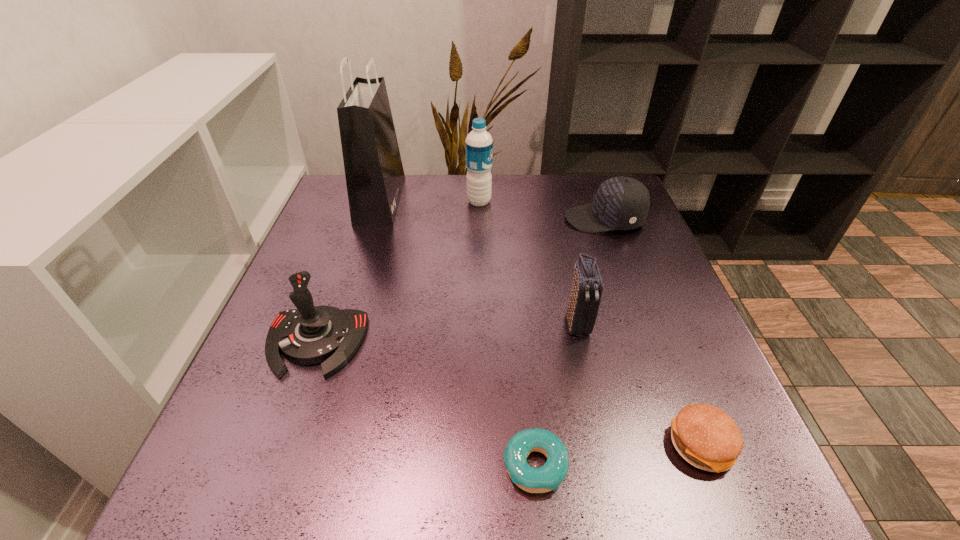
Where is `baseball cap at the far edge`? baseball cap at the far edge is located at coordinates (621, 203).

Find the location of a particular element. hamburger that is positioned at the near edge is located at coordinates (705, 436).

Where is `doughnut located in the near edge section of the desktop`? This screenshot has width=960, height=540. doughnut located in the near edge section of the desktop is located at coordinates (548, 477).

The height and width of the screenshot is (540, 960). I want to click on shopping bag located at the left edge, so click(x=374, y=173).

The width and height of the screenshot is (960, 540). I want to click on joystick present at the left edge, so click(308, 335).

At what (x,y) coordinates should I click in order to perform the action: click on baseball cap situated at the right edge. Please return your answer as a coordinate pair (x, y). The height and width of the screenshot is (540, 960). Looking at the image, I should click on (621, 203).

The image size is (960, 540). What are the coordinates of `hamburger that is at the right edge` in the screenshot? It's located at (705, 436).

The width and height of the screenshot is (960, 540). I want to click on object located in the far left corner section of the desktop, so click(x=374, y=173).

Locate an element on the screen. object that is at the far right corner is located at coordinates (621, 203).

Identify the location of object at the near right corner. (705, 436).